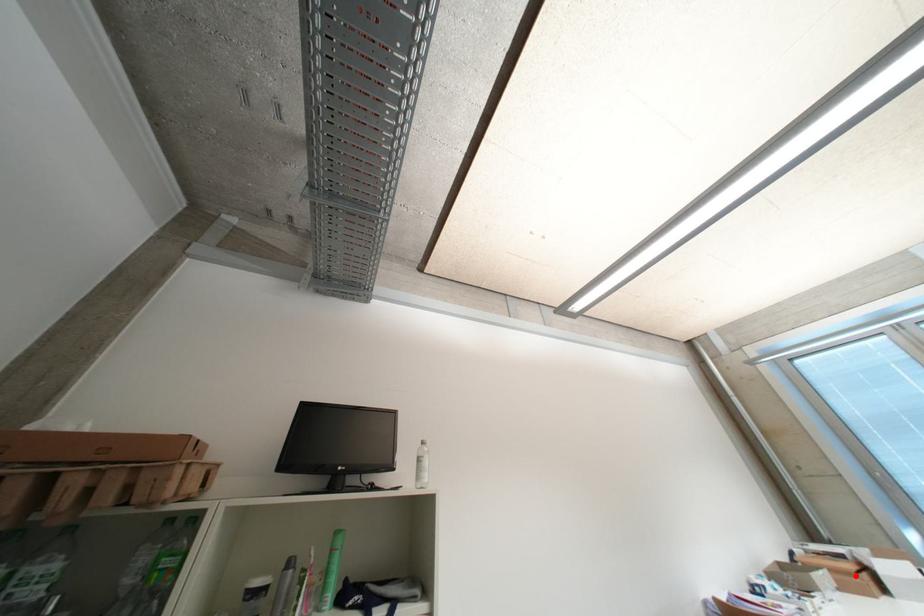
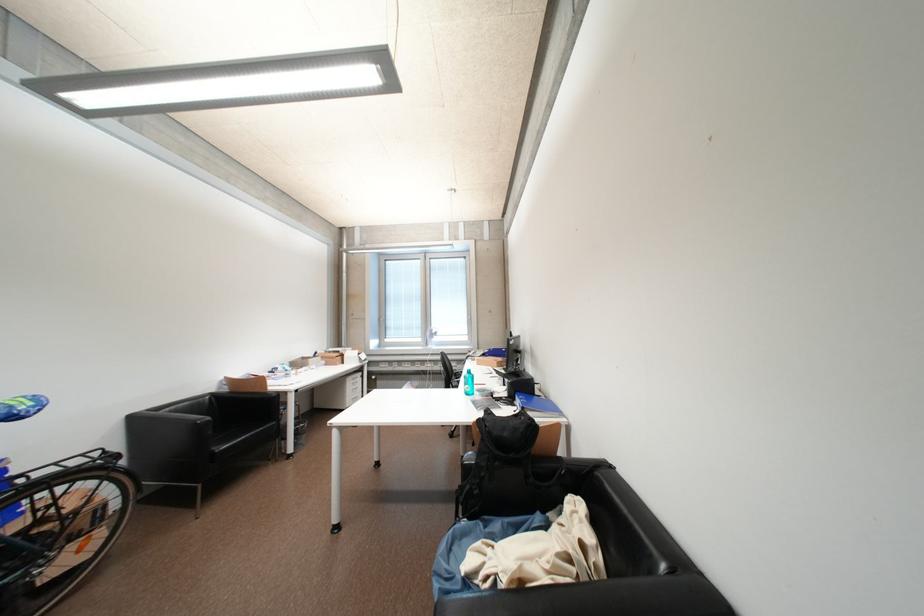
Locate, in the second image, the point that corresponds to the highlighted location in the first image.

(341, 360)